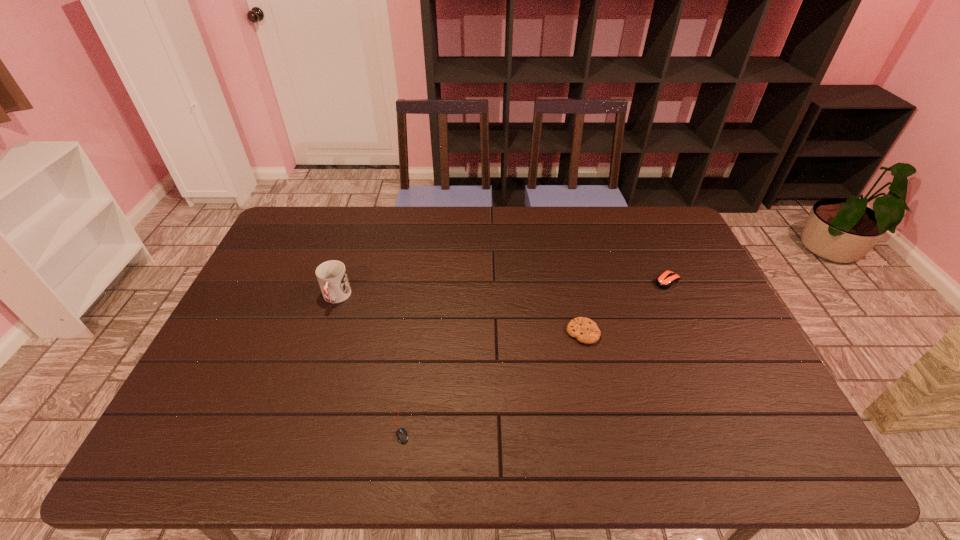
Identify the location of the leftmost object. (332, 277).

At what (x,y) coordinates should I click in order to perform the action: click on the tallest object. Please return your answer as a coordinate pair (x, y). Looking at the image, I should click on (332, 277).

I want to click on the right mouse, so click(x=665, y=280).

The image size is (960, 540). I want to click on the farther mouse, so click(x=665, y=280).

Find the location of a particular element. This screenshot has height=540, width=960. the third object from left to right is located at coordinates (586, 331).

Image resolution: width=960 pixels, height=540 pixels. Identify the location of cookie. (586, 331).

Identify the location of the shortest object. Image resolution: width=960 pixels, height=540 pixels. (402, 437).

You are a GUI agent. You are given a task and a screenshot of the screen. Output one action in this format:
    pyautogui.click(x=<x>, y=<y>)
    Task: Click on the nearer mouse
    
    Given the screenshot: What is the action you would take?
    pyautogui.click(x=402, y=437)

The width and height of the screenshot is (960, 540). Identify the location of vacant region located on the handle side of the tallest object. (309, 378).

The height and width of the screenshot is (540, 960). Identify the location of free space located 0.340m on the front of the right mouse. (713, 383).